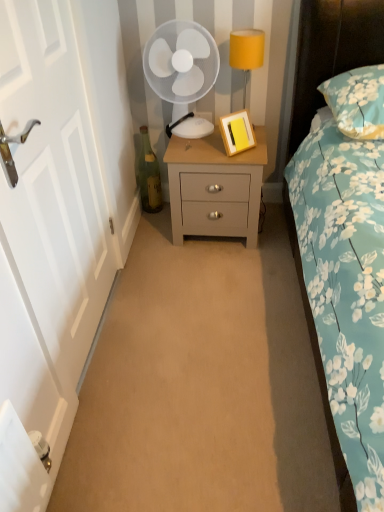
Find the location of a particular element. vacant space that is in between light gray wood nightstand at center and white painted wood door at left is located at coordinates (168, 284).